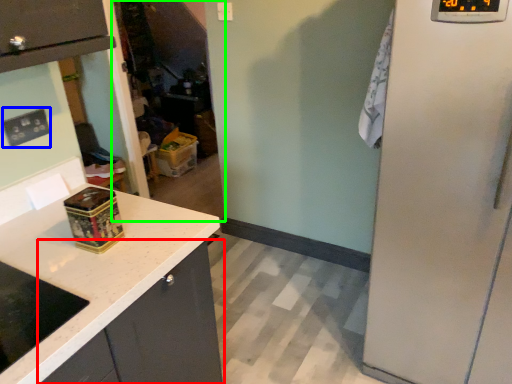
Question: Which is farther away from cabinetry (highlighted by a red box)? electric outlet (highlighted by a blue box) or glass door (highlighted by a green box)?

Choices:
 (A) electric outlet
 (B) glass door

Answer: (B)